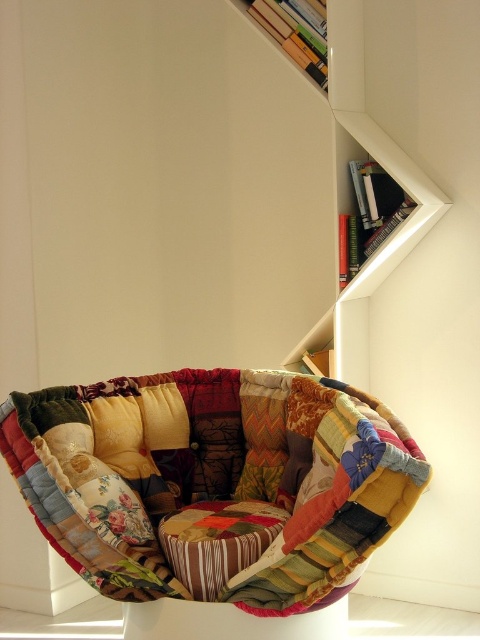
Is patchwork fabric cushion at center above wooden bookshelf at upper right?

Incorrect, patchwork fabric cushion at center is not positioned above wooden bookshelf at upper right.

Is point (264, 593) farther from camera compared to point (358, 115)?

That is False.

Does point (87, 470) come farther from viewer compared to point (370, 273)?

No, it is in front of (370, 273).

This screenshot has height=640, width=480. Identify the location of patchwork fabric cushion at center. (213, 483).